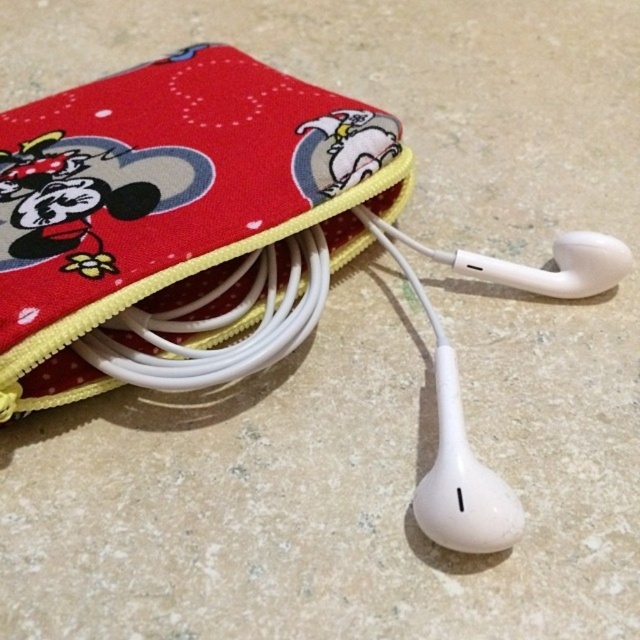
You are trying to determine the spatial relationship between the objects in the image. Which object is closer to the viewer, the matte fabric pouch at upper left or the white matte earphones at center?

The matte fabric pouch at upper left is closer to the viewer than the white matte earphones at center, which are positioned behind it.

You are holding a red pouch with Minnie Mouse and Daisy Duck designs. You want to place a small keychain exactly at the point marked as point (177, 220). Where should you place the keychain on the pouch?

The point (177, 220) corresponds to the matte fabric pouch at upper left, so you should place the keychain on the matte fabric pouch at upper left area of the pouch.

You are trying to determine if the white matte earphones at center can fit inside the matte fabric pouch at upper left. The earphones are 10 inches long when fully extended. Can they fit inside the pouch?

The distance between the matte fabric pouch at upper left and white matte earphones at center is 12.40 inches, but this measurement refers to their separation in the image, not the size of the pouch. Since the earphones are only 10 inches long when fully extended, they should fit inside the pouch if the pouch has sufficient internal space. However, the provided information does not specify the pouch size, so we cannot confirm based solely on the distance between them.